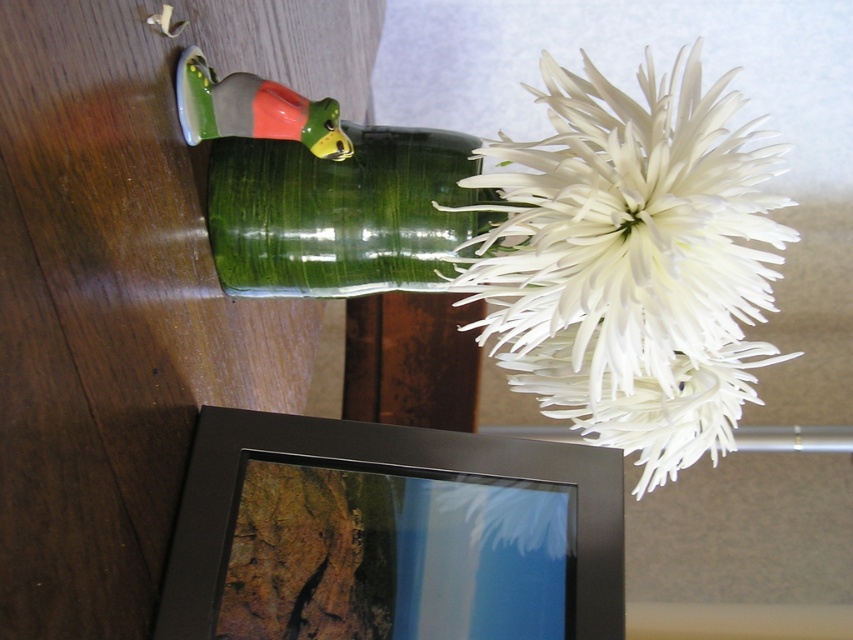
Question: Is white matte flower at upper right behind green glass vase at upper center?

Choices:
 (A) yes
 (B) no

Answer: (B)

Question: Is white matte flower at upper right smaller than green glass vase at upper center?

Choices:
 (A) no
 (B) yes

Answer: (A)

Question: Does white matte flower at upper right come in front of green glass vase at upper center?

Choices:
 (A) yes
 (B) no

Answer: (A)

Question: Among these points, which one is farthest from the camera?

Choices:
 (A) (694, 145)
 (B) (440, 541)
 (C) (274, 237)

Answer: (C)

Question: Which is farther from the green glass vase at upper center?

Choices:
 (A) black matte picture frame at lower center
 (B) white matte flower at upper right

Answer: (A)

Question: Estimate the real-world distances between objects in this image. Which object is closer to the green glass vase at upper center?

Choices:
 (A) white matte flower at upper right
 (B) black matte picture frame at lower center

Answer: (A)